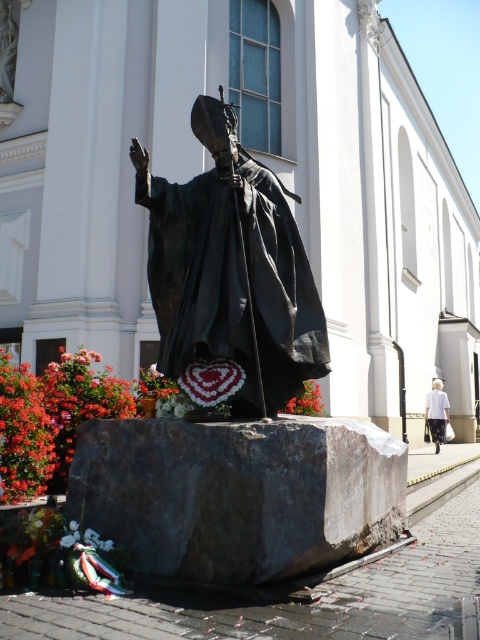
You are an art conservator assessing the statue and its pedestal. Given that the bronze statue at center is taller than the gray rough stone at center, which object would you need to adjust if you want the statue to appear more integrated with its pedestal?

The bronze statue at center is taller than the gray rough stone at center. To make the statue appear more integrated, you would need to adjust the height of the bronze statue at center to match the proportions of the gray rough stone at center.